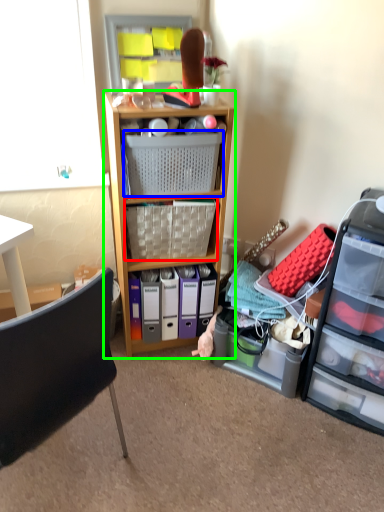
Question: Which is farther away from picnic basket (highlighted by a red box)? picnic basket (highlighted by a blue box) or shelf (highlighted by a green box)?

Choices:
 (A) picnic basket
 (B) shelf

Answer: (A)